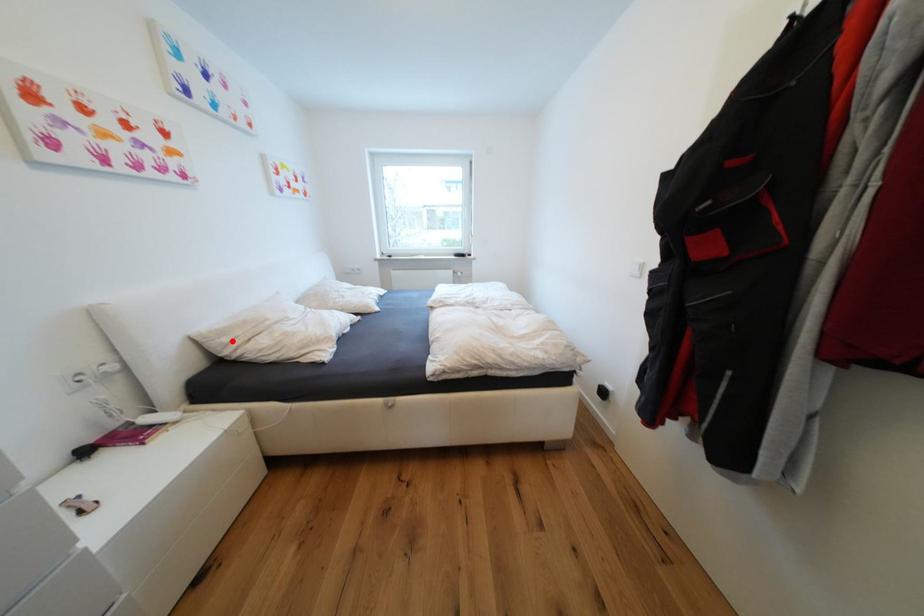
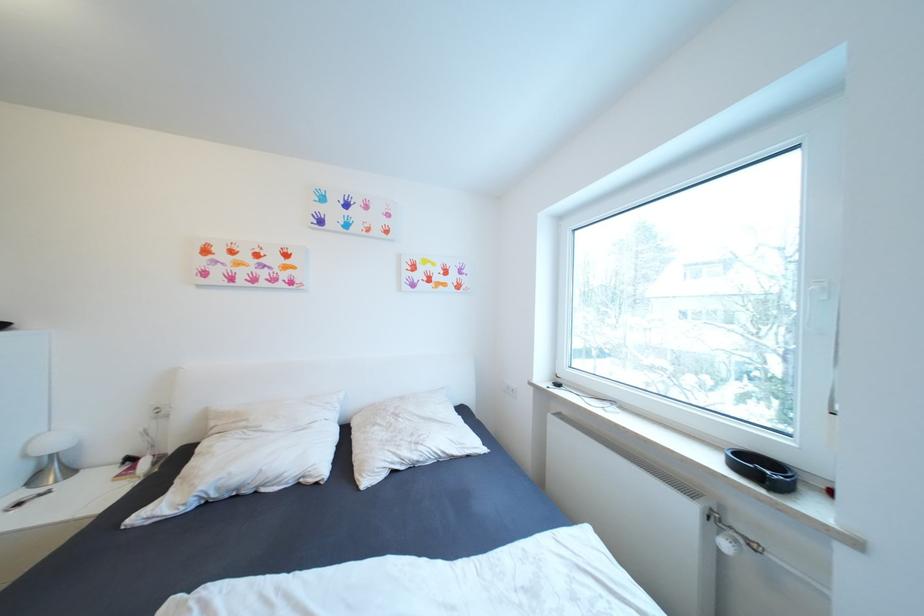
Find the pixel in the second image that matches the highlighted location in the first image.

(220, 424)